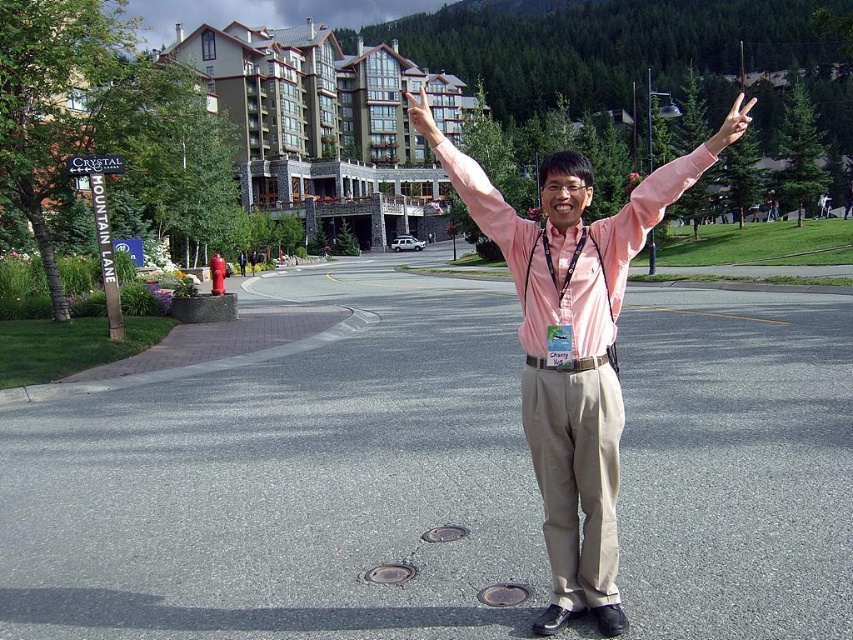
Question: Is pink fabric shirt at center smaller than brown stone building at upper center?

Choices:
 (A) no
 (B) yes

Answer: (B)

Question: Is khaki cotton pants at center thinner than pink fabric arm at center?

Choices:
 (A) yes
 (B) no

Answer: (A)

Question: Which point is closer to the camera?

Choices:
 (A) (477, 129)
 (B) (734, 115)
 (C) (432, 140)
 (D) (566, 509)

Answer: (B)

Question: Based on their relative distances, which object is farther from the pink fabric hand at center?

Choices:
 (A) pink fabric arm at center
 (B) pink fabric shirt at center
 (C) brown stone building at upper center
 (D) matte pink hand at upper center

Answer: (D)

Question: Which point is farther to the camera?

Choices:
 (A) pink fabric hand at center
 (B) pink fabric arm at center
 (C) brown stone building at upper center

Answer: (C)

Question: From the image, what is the correct spatial relationship of khaki cotton pants at center in relation to pink fabric arm at center?

Choices:
 (A) above
 (B) below

Answer: (B)